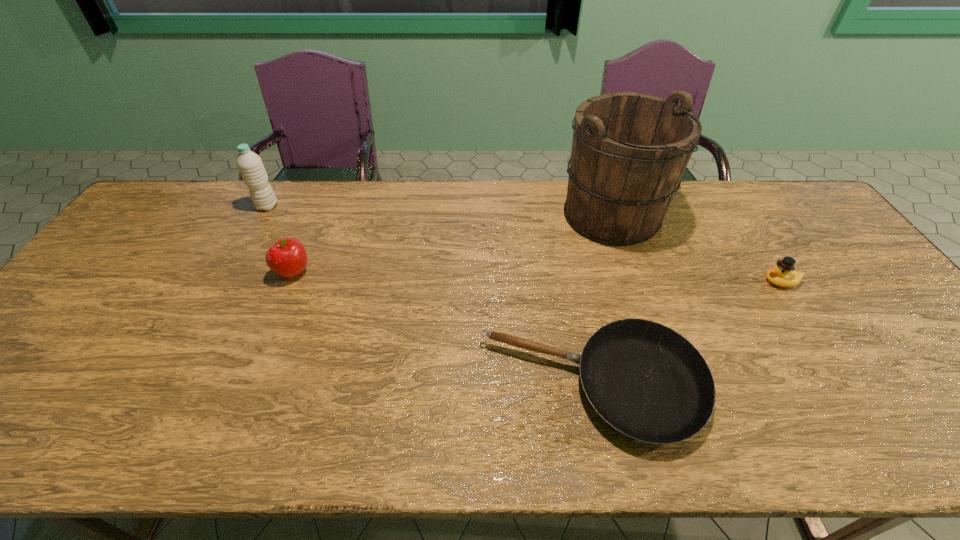
Image resolution: width=960 pixels, height=540 pixels. In the image, there is a desktop. What are the coordinates of `vacant space at the near edge` in the screenshot? It's located at (423, 416).

This screenshot has height=540, width=960. Find the location of `vacant space at the left edge of the desktop`. vacant space at the left edge of the desktop is located at coordinates (115, 319).

The width and height of the screenshot is (960, 540). I want to click on free region at the right edge, so click(x=845, y=316).

Locate an element on the screen. The image size is (960, 540). free space between the second object from left to right and the bucket is located at coordinates (452, 244).

Where is `vacant area that lies between the bucket and the apple`? This screenshot has width=960, height=540. vacant area that lies between the bucket and the apple is located at coordinates click(x=452, y=244).

Where is `unoccupied area between the frying pan and the third tallest object`? The height and width of the screenshot is (540, 960). unoccupied area between the frying pan and the third tallest object is located at coordinates (443, 329).

Locate an element on the screen. The image size is (960, 540). vacant region between the duck and the bucket is located at coordinates (697, 248).

Locate an element on the screen. The image size is (960, 540). vacant space that's between the nearest object and the bucket is located at coordinates (602, 300).

At what (x,y) coordinates should I click in order to perform the action: click on free space that is in between the fourth tallest object and the water bottle. Please return your answer as a coordinate pair (x, y). The height and width of the screenshot is (540, 960). Looking at the image, I should click on coord(524,244).

The width and height of the screenshot is (960, 540). I want to click on vacant area that lies between the frying pan and the duck, so click(x=686, y=333).